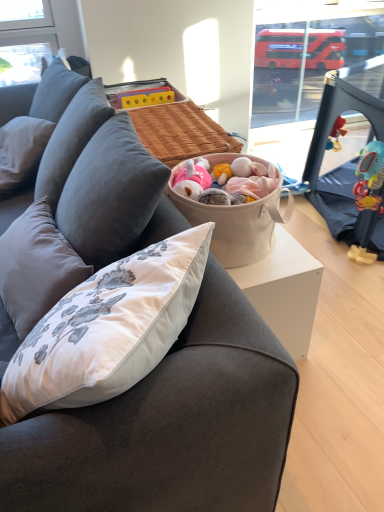
Question: From a real-world perspective, is gray fabric pillow at left on top of dark gray fabric couch at center?

Choices:
 (A) no
 (B) yes

Answer: (B)

Question: Can you see gray fabric pillow at left touching dark gray fabric couch at center?

Choices:
 (A) yes
 (B) no

Answer: (B)

Question: Does gray fabric pillow at left have a larger size compared to dark gray fabric couch at center?

Choices:
 (A) no
 (B) yes

Answer: (A)

Question: From the image's perspective, is gray fabric pillow at left on dark gray fabric couch at center?

Choices:
 (A) yes
 (B) no

Answer: (A)

Question: Does gray fabric pillow at left have a greater height compared to dark gray fabric couch at center?

Choices:
 (A) no
 (B) yes

Answer: (A)

Question: Does gray fabric pillow at left have a lesser height compared to dark gray fabric couch at center?

Choices:
 (A) yes
 (B) no

Answer: (A)

Question: Is beige fabric basket at center bigger than dark gray fabric couch at center?

Choices:
 (A) no
 (B) yes

Answer: (A)

Question: From the image's perspective, does beige fabric basket at center appear higher than dark gray fabric couch at center?

Choices:
 (A) no
 (B) yes

Answer: (B)

Question: Is beige fabric basket at center aimed at dark gray fabric couch at center?

Choices:
 (A) no
 (B) yes

Answer: (A)

Question: Is the surface of beige fabric basket at center in direct contact with dark gray fabric couch at center?

Choices:
 (A) yes
 (B) no

Answer: (B)

Question: Is beige fabric basket at center in front of dark gray fabric couch at center?

Choices:
 (A) no
 (B) yes

Answer: (A)

Question: From a real-world perspective, is beige fabric basket at center physically below dark gray fabric couch at center?

Choices:
 (A) no
 (B) yes

Answer: (A)

Question: From the image's perspective, does gray fabric pillow at left appear lower than beige fabric basket at center?

Choices:
 (A) no
 (B) yes

Answer: (A)